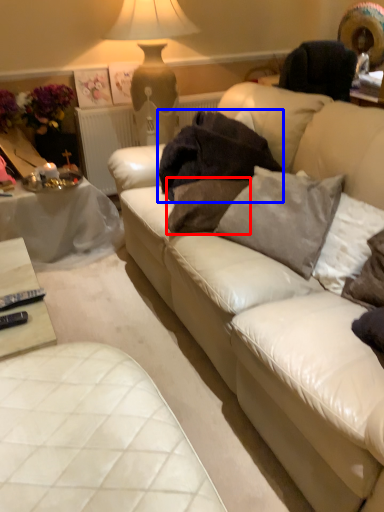
Question: Which object is further to the camera taking this photo, pillow (highlighted by a red box) or blanket (highlighted by a blue box)?

Choices:
 (A) pillow
 (B) blanket

Answer: (B)